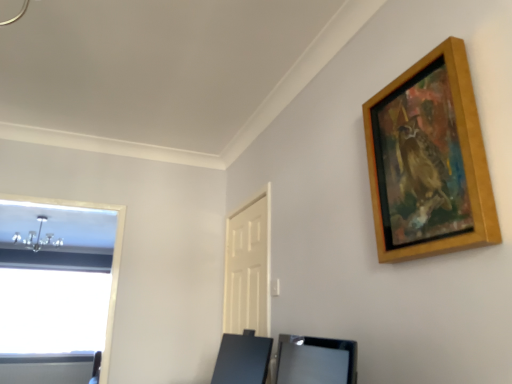
Question: Considering the relative sizes of wooden picture frame at upper right and black glossy vanity at lower center, which is the 2th vanity from front to back, in the image provided, is wooden picture frame at upper right wider than black glossy vanity at lower center, which is the 2th vanity from front to back,?

Choices:
 (A) yes
 (B) no

Answer: (B)

Question: Is black glossy vanity at lower center, the 1th vanity viewed from the back, at the back of wooden picture frame at upper right?

Choices:
 (A) yes
 (B) no

Answer: (B)

Question: From the image's perspective, does wooden picture frame at upper right appear higher than black glossy vanity at lower center, which is the 2th vanity from front to back?

Choices:
 (A) no
 (B) yes

Answer: (B)

Question: Is wooden picture frame at upper right further to the viewer compared to black glossy vanity at lower center, the 1th vanity viewed from the back?

Choices:
 (A) yes
 (B) no

Answer: (B)

Question: Does wooden picture frame at upper right appear on the right side of black glossy vanity at lower center, the 1th vanity viewed from the back?

Choices:
 (A) no
 (B) yes

Answer: (B)

Question: Relative to black glossy vanity at lower center, which is the 2th vanity from front to back, is wooden picture frame at upper right in front or behind?

Choices:
 (A) behind
 (B) front

Answer: (B)

Question: From the image's perspective, is wooden picture frame at upper right above or below black glossy vanity at lower center, which is the 2th vanity from front to back?

Choices:
 (A) below
 (B) above

Answer: (B)

Question: Looking at their shapes, would you say wooden picture frame at upper right is wider or thinner than black glossy vanity at lower center, which is the 2th vanity from front to back?

Choices:
 (A) thin
 (B) wide

Answer: (A)

Question: Considering the positions of point (455, 137) and point (262, 382), is point (455, 137) closer or farther from the camera than point (262, 382)?

Choices:
 (A) farther
 (B) closer

Answer: (B)

Question: In terms of height, does satin black vanity at lower center, arranged as the second vanity when viewed from the back, look taller or shorter compared to wooden picture frame at upper right?

Choices:
 (A) short
 (B) tall

Answer: (A)

Question: Is satin black vanity at lower center, arranged as the second vanity when viewed from the back, in front of or behind wooden picture frame at upper right in the image?

Choices:
 (A) front
 (B) behind

Answer: (B)

Question: In the image, is satin black vanity at lower center, arranged as the second vanity when viewed from the back, on the left side or the right side of wooden picture frame at upper right?

Choices:
 (A) right
 (B) left

Answer: (B)

Question: Is satin black vanity at lower center, which is the first vanity in front-to-back order, wider or thinner than wooden picture frame at upper right?

Choices:
 (A) wide
 (B) thin

Answer: (A)

Question: In terms of size, does satin black vanity at lower center, which is the first vanity in front-to-back order, appear bigger or smaller than white matte door at center?

Choices:
 (A) small
 (B) big

Answer: (A)

Question: From a real-world perspective, is satin black vanity at lower center, which is the first vanity in front-to-back order, positioned above or below white matte door at center?

Choices:
 (A) below
 (B) above

Answer: (A)